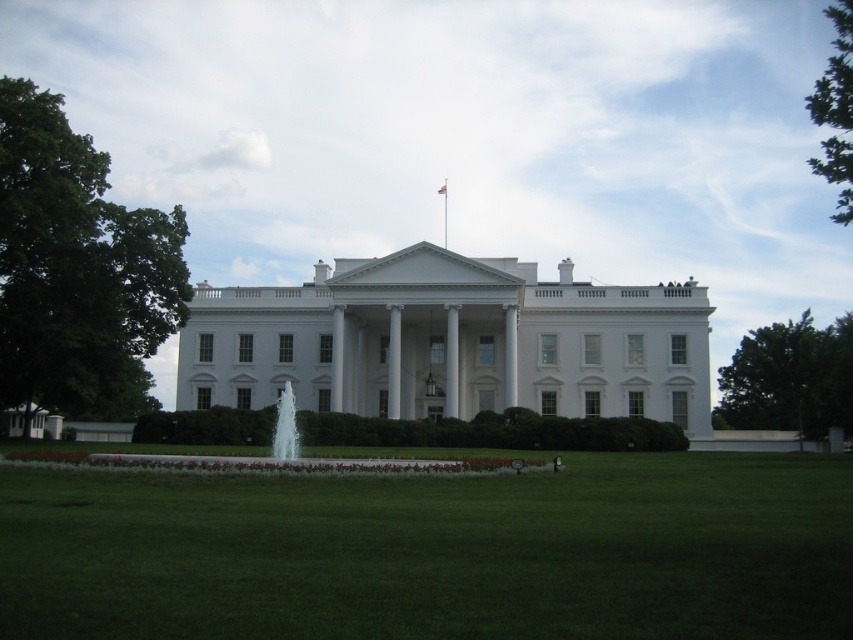
Question: Can you confirm if white marble pillar at center is bigger than white smooth pillar at center?

Choices:
 (A) no
 (B) yes

Answer: (A)

Question: Is green grass at lower center further to camera compared to white glossy pillar at center?

Choices:
 (A) yes
 (B) no

Answer: (B)

Question: Where is green leafy tree at upper right located in relation to white marble pillar at center in the image?

Choices:
 (A) below
 (B) above

Answer: (B)

Question: Which object is the farthest from the green grass at lower center?

Choices:
 (A) green leafy tree at right
 (B) green leafy tree at upper right
 (C) white marble pillar at center
 (D) white smooth pillar at center

Answer: (A)

Question: Which point appears closest to the camera in this image?

Choices:
 (A) (144, 264)
 (B) (392, 333)
 (C) (338, 344)

Answer: (A)

Question: Which point is farther from the camera taking this photo?

Choices:
 (A) (123, 312)
 (B) (451, 385)
 (C) (842, 52)
 (D) (512, 365)

Answer: (C)